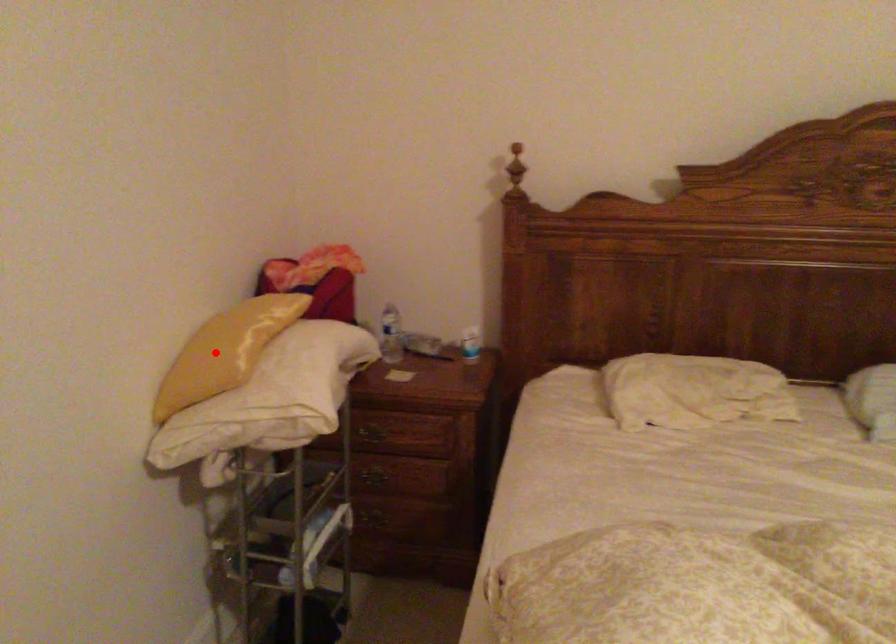
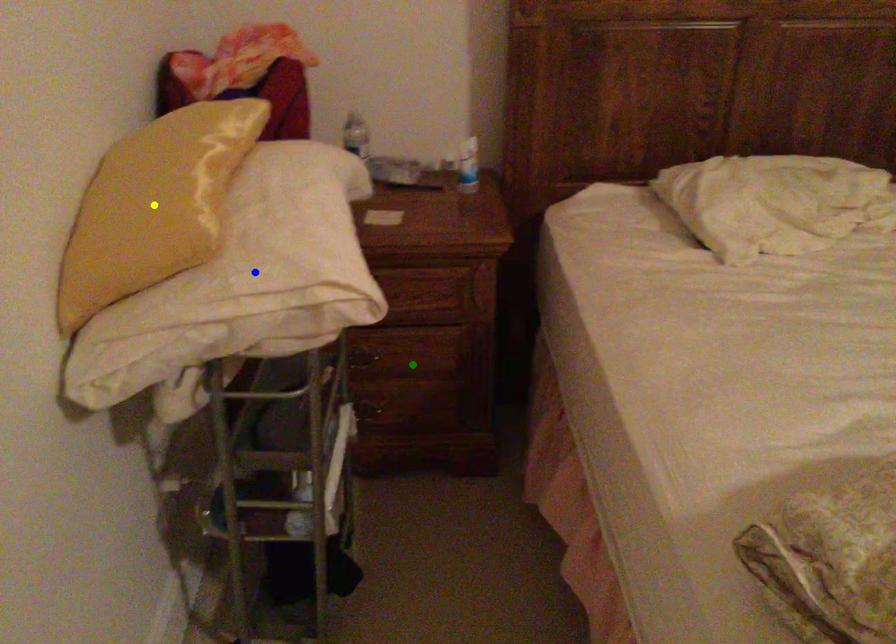
Question: I am providing you with two images of the same scene from different viewpoints. A red point is marked on the first image. You are given multiple points on the second image. Can you choose the point in image 2 that corresponds to the point in image 1?

Choices:
 (A) blue point
 (B) green point
 (C) yellow point

Answer: (C)